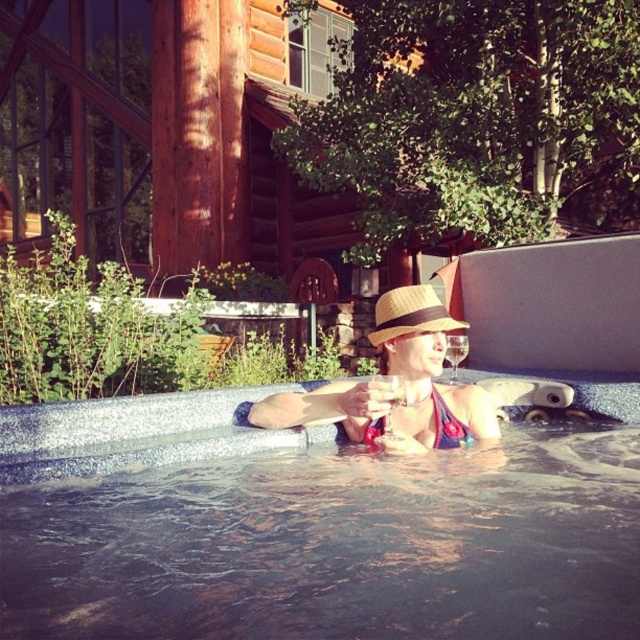
You are standing in the scene and want to place a small decorative rock. You have two options for placement locations, point A at point (x=307, y=513) and point B at point (x=349, y=388). Which point is closer to you?

Point A at point (x=307, y=513) is closer to you than point B at point (x=349, y=388).

You are a contractor assessing the hot tub area. You need to install a new railing around the smooth concrete pool at center. The railing must be 1.2 meters tall. Given the height of the matte straw hat at center, will the railing be taller than the hat?

The smooth concrete pool at center has a lesser height compared to matte straw hat at center. Since the railing is 1.2 meters tall, and the pool is shorter than the hat, we can infer the hat is taller than 1.2 meters. Therefore, the railing will not be taller than the matte straw hat at center.